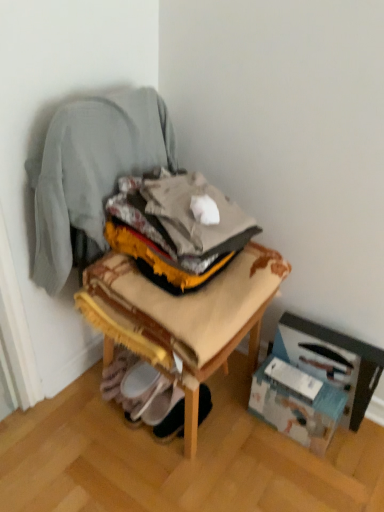
Find the location of a particular element. blank space above white fabric shoe at lower center (from a real-world perspective) is located at coordinates (180, 411).